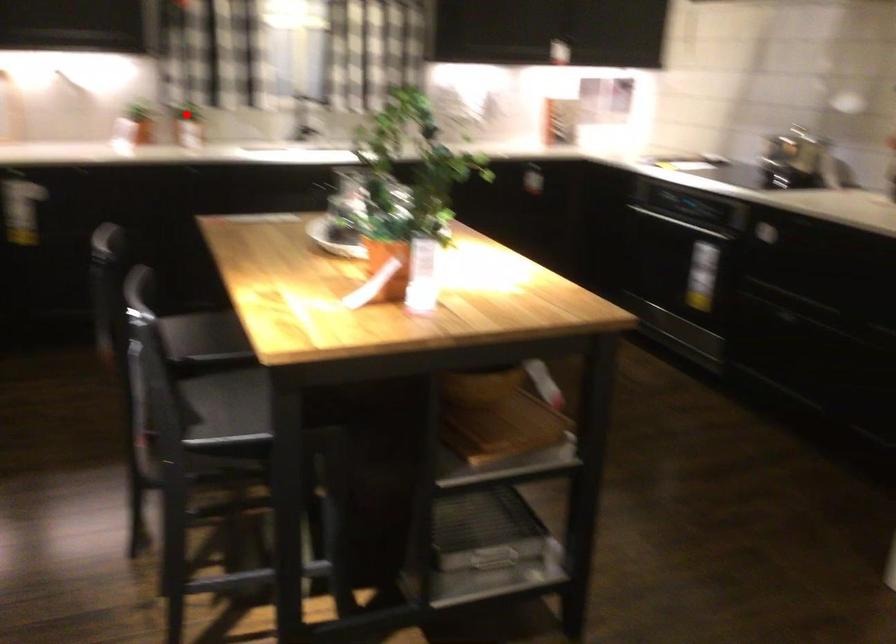
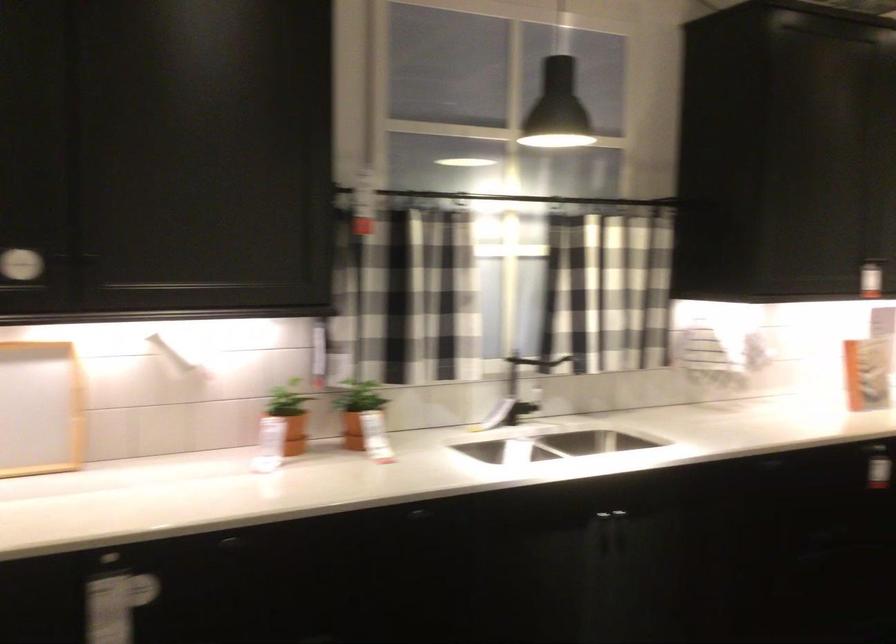
In the second image, find the point that corresponds to the highlighted location in the first image.

(357, 410)